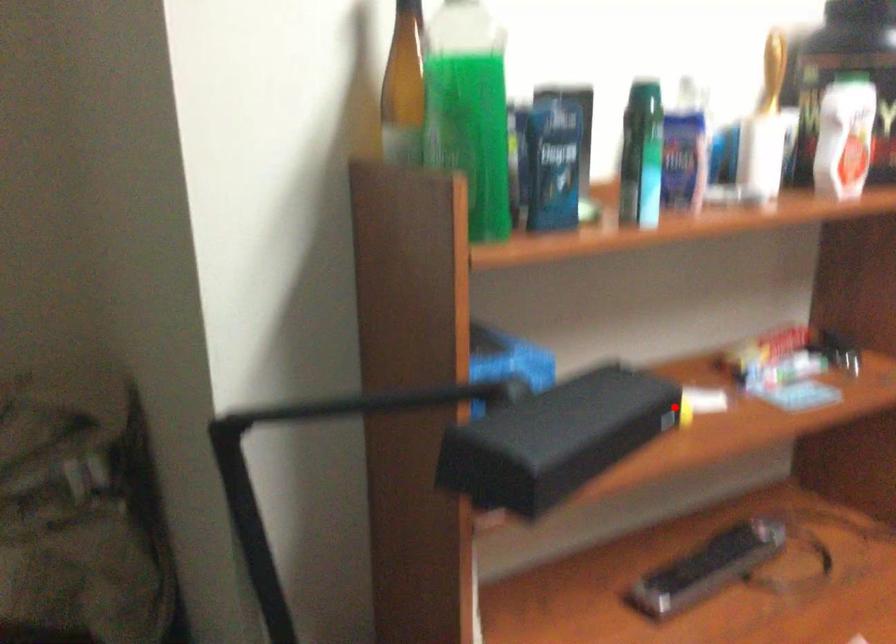
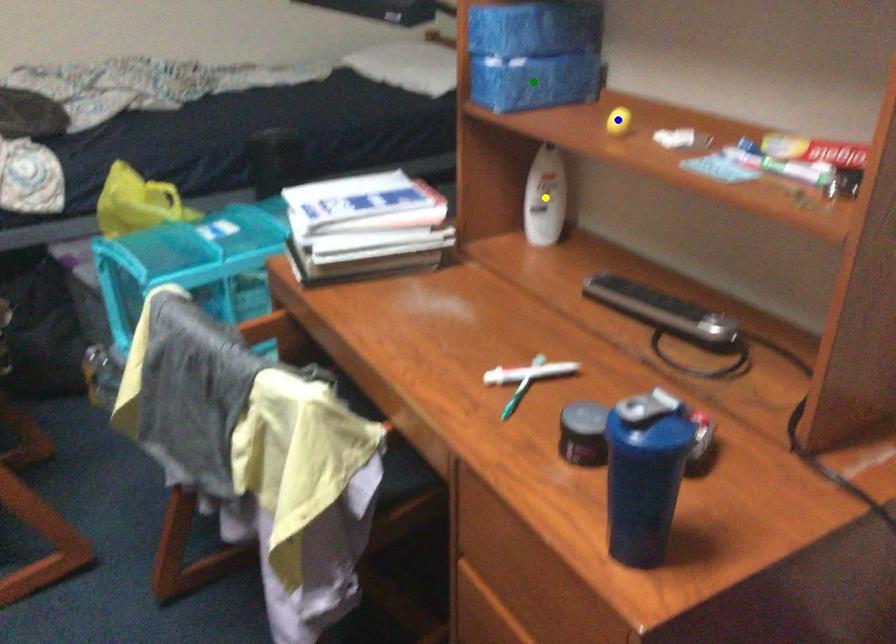
Question: I am providing you with two images of the same scene from different viewpoints. A red point is marked on the first image. You are given multiple points on the second image. Which mark in image 2 goes with the point in image 1?

Choices:
 (A) yellow point
 (B) blue point
 (C) green point

Answer: (B)